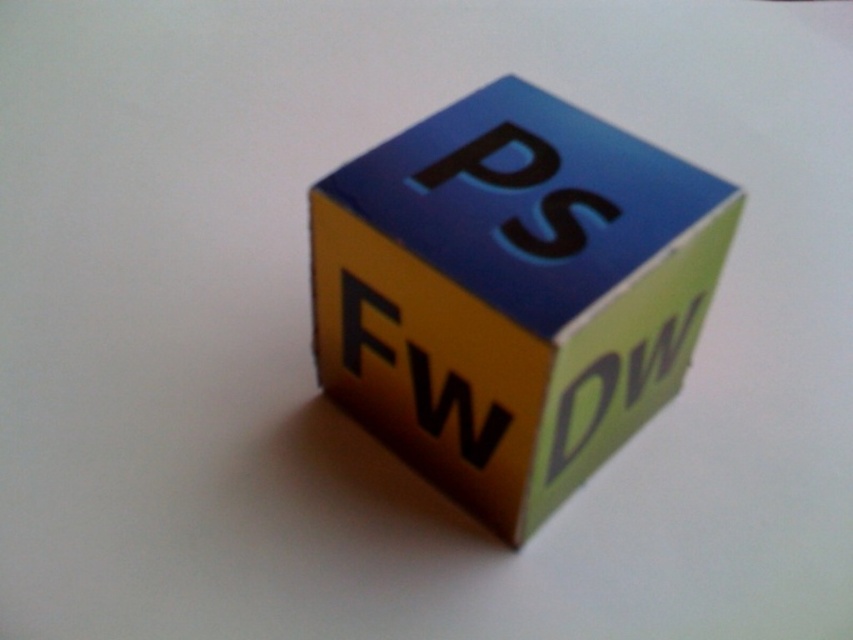
Question: Is blue matte letter at upper center thinner than green matte/dw at center?

Choices:
 (A) yes
 (B) no

Answer: (B)

Question: Is blue matte letter at upper center bigger than black matte letter w at center?

Choices:
 (A) no
 (B) yes

Answer: (B)

Question: Which object is closer to the camera taking this photo?

Choices:
 (A) green matte/dw at center
 (B) matte yellow letter at center
 (C) blue matte letter at upper center
 (D) black matte letter w at center

Answer: (C)

Question: Which object is closer to the camera taking this photo?

Choices:
 (A) green matte/dw at center
 (B) matte plastic cube at center
 (C) blue matte letter at upper center
 (D) black matte letter w at center

Answer: (B)

Question: Does black matte letter w at center appear over matte yellow letter at center?

Choices:
 (A) yes
 (B) no

Answer: (B)

Question: Which point is closer to the camera?

Choices:
 (A) (502, 129)
 (B) (341, 312)

Answer: (A)